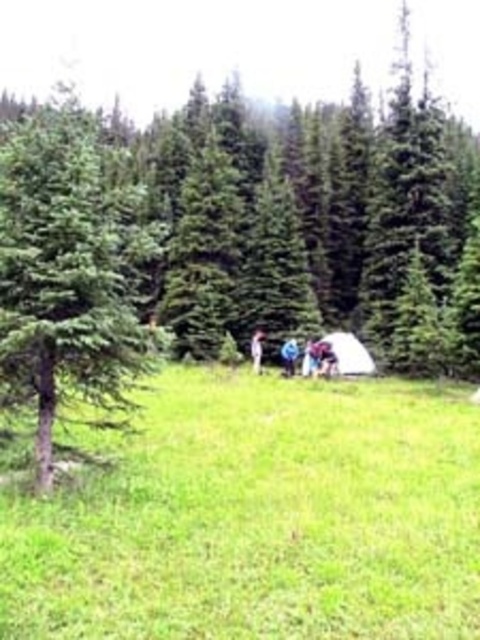
Question: Which point appears closest to the camera in this image?

Choices:
 (A) pos(260,371)
 (B) pos(108,369)

Answer: (B)

Question: Is blue fabric at center to the left of white fabric tent at center from the viewer's perspective?

Choices:
 (A) yes
 (B) no

Answer: (B)

Question: Is green needle-like tree at left behind white fabric tent at center?

Choices:
 (A) no
 (B) yes

Answer: (A)

Question: Can you confirm if green needle-like tree at left is positioned below blue fabric at center?

Choices:
 (A) no
 (B) yes

Answer: (A)

Question: Estimate the real-world distances between objects in this image. Which object is farther from the white fabric tent at center?

Choices:
 (A) blue fabric at center
 (B) green needle-like tree at left

Answer: (B)

Question: Which of the following is the closest to the observer?

Choices:
 (A) (251, 349)
 (B) (62, 236)
 (C) (289, 376)

Answer: (B)